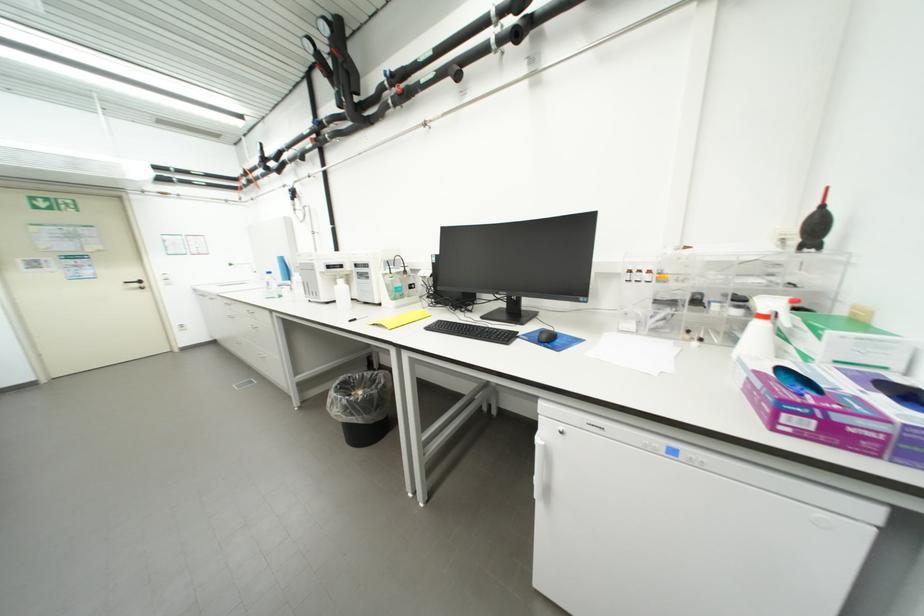
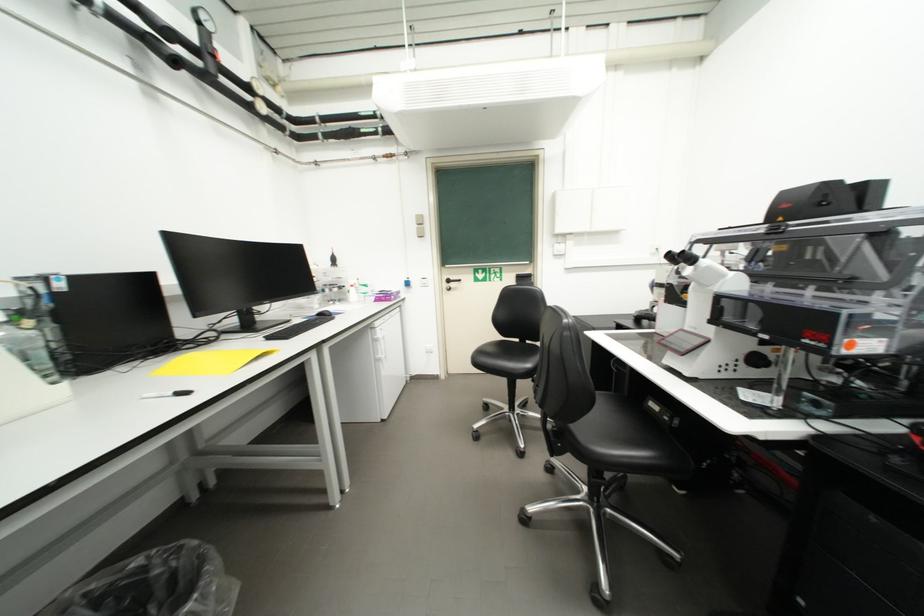
Question: I am providing you with two images of the same scene from different viewpoints. Which of the following objects are not visible in image2?

Choices:
 (A) black computer keyboard
 (B) black computer mouse
 (C) seashell
 (D) small amber bottle

Answer: (D)